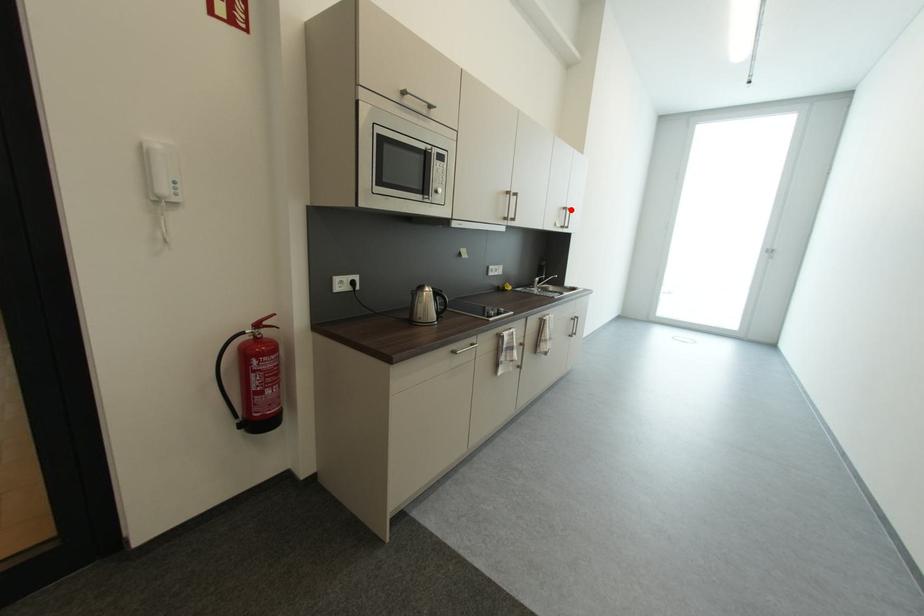
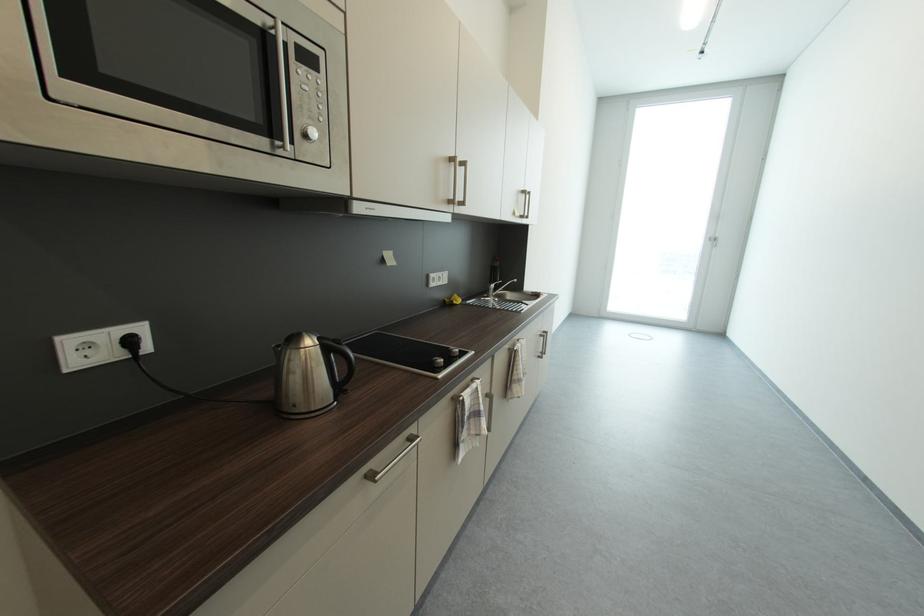
Where in the second image is the point corresponding to the highlighted location from the first image?

(529, 193)